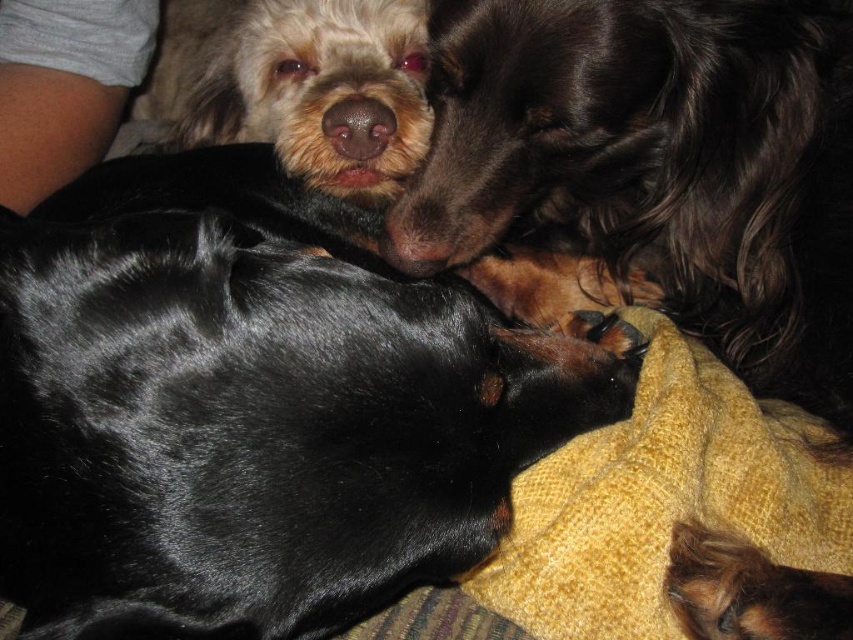
How much distance is there between shiny black coat at upper center and shiny brown fur at lower right?

The distance of shiny black coat at upper center from shiny brown fur at lower right is 22.18 inches.

The width and height of the screenshot is (853, 640). In order to click on shiny black coat at upper center in this screenshot , I will do `click(293, 81)`.

Who is positioned more to the right, shiny brown fur at upper center or yellow textured blanket at lower right?

shiny brown fur at upper center is more to the right.

Looking at this image, who is lower down, shiny brown fur at upper center or yellow textured blanket at lower right?

Positioned lower is yellow textured blanket at lower right.

Which is in front, point (677, 1) or point (827, 452)?

Point (677, 1) is in front.

Locate an element on the screen. shiny brown fur at upper center is located at coordinates (659, 164).

Who is more distant from viewer, (409, 132) or (341, 131)?

Point (409, 132)

Identify the location of shaggy white fur at upper left. The image size is (853, 640). (297, 84).